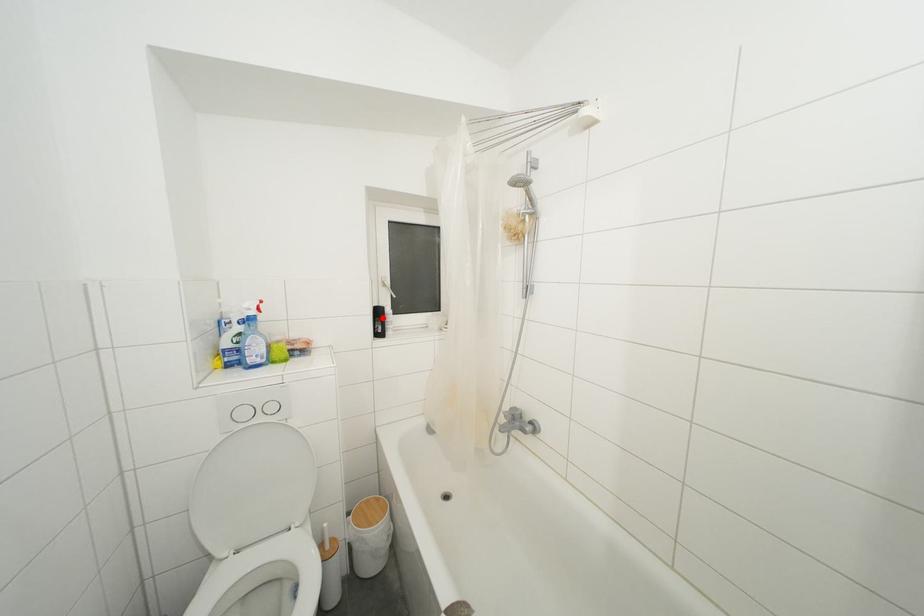
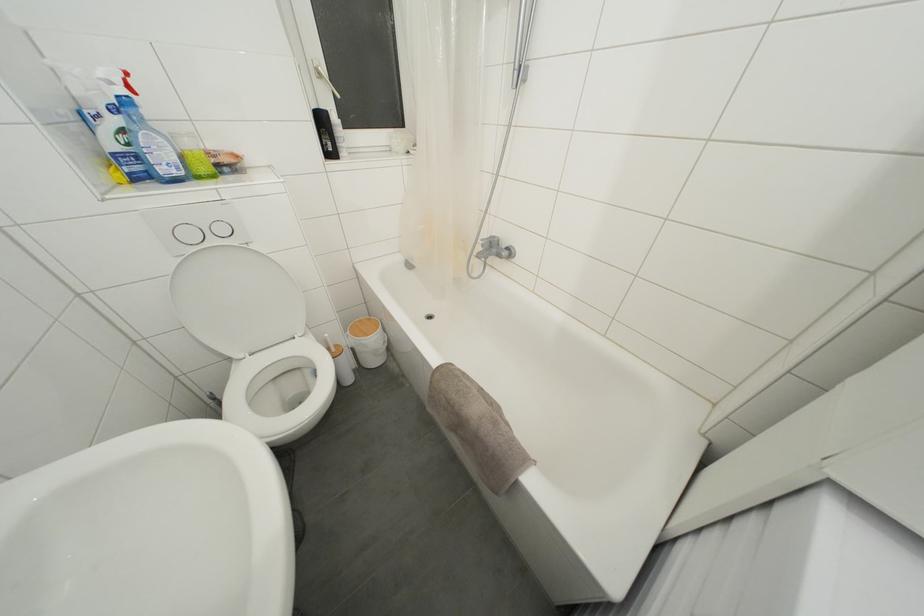
Question: I am providing you with two images of the same scene from different viewpoints. A red point is marked on the first image. Can you still see the location of the red point in image 2?

Choices:
 (A) Yes
 (B) No

Answer: (A)